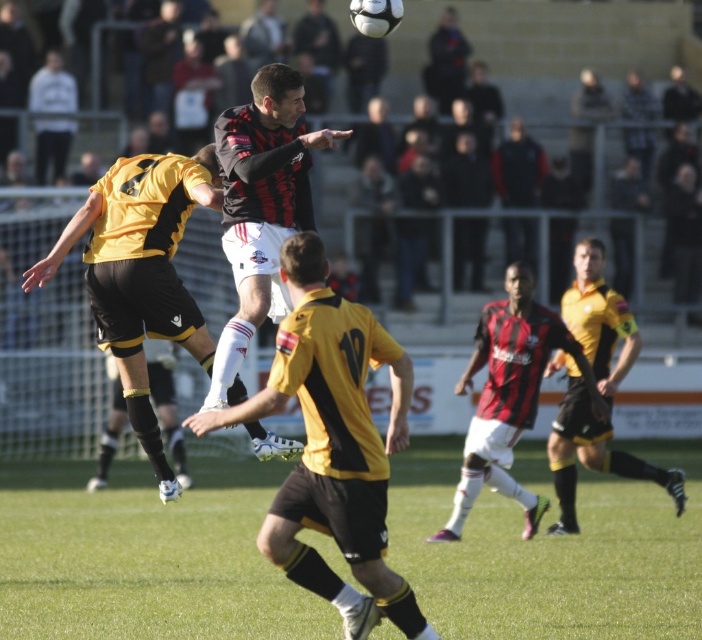
You are a soccer coach analyzing the game footage. You notice a point at coordinates (140, 273) on the field. Based on the image, which player is this point located on?

The point at coordinates (140, 273) is on the yellow jersey with black accents and black shorts, which belongs to the player positioned below the airborne player attempting to block or intercept the ball.